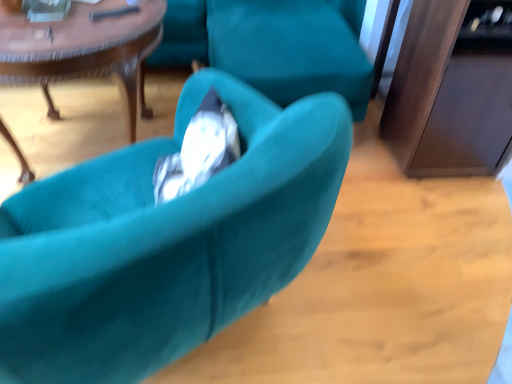
This screenshot has height=384, width=512. What do you see at coordinates (84, 49) in the screenshot? I see `wooden polished coffee table at center` at bounding box center [84, 49].

Identify the location of wooden polished coffee table at center. (84, 49).

What is the approximate width of wooden polished coffee table at center?

wooden polished coffee table at center is 85.18 centimeters in width.

This screenshot has width=512, height=384. Identify the location of teal velvet chair at center. (x=164, y=241).

What do you see at coordinates (164, 241) in the screenshot? The width and height of the screenshot is (512, 384). I see `teal velvet chair at center` at bounding box center [164, 241].

In order to click on wooden polished coffee table at center in this screenshot , I will do `click(84, 49)`.

Can you confirm if teal velvet chair at center is positioned to the left of wooden polished coffee table at center?

No.

Which is behind, teal velvet chair at center or wooden polished coffee table at center?

Positioned behind is wooden polished coffee table at center.

Considering the positions of point (271, 110) and point (51, 53), is point (271, 110) closer or farther from the camera than point (51, 53)?

Point (271, 110).

From the image's perspective, does teal velvet chair at center appear lower than wooden polished coffee table at center?

Indeed, from the image's perspective, teal velvet chair at center is shown beneath wooden polished coffee table at center.

From a real-world perspective, which is physically above, teal velvet chair at center or wooden polished coffee table at center?

From a 3D spatial view, teal velvet chair at center is above.

Considering the relative sizes of teal velvet chair at center and wooden polished coffee table at center in the image provided, is teal velvet chair at center thinner than wooden polished coffee table at center?

Yes.

Who is shorter, teal velvet chair at center or wooden polished coffee table at center?

wooden polished coffee table at center.

Does teal velvet chair at center have a smaller size compared to wooden polished coffee table at center?

No.

Consider the image. Is teal velvet chair at center situated inside wooden polished coffee table at center or outside?

teal velvet chair at center cannot be found inside wooden polished coffee table at center.

Is teal velvet chair at center not near wooden polished coffee table at center?

No.

Is wooden polished coffee table at center at the back of teal velvet chair at center?

teal velvet chair at center does not have its back to wooden polished coffee table at center.

The height and width of the screenshot is (384, 512). What are the coordinates of `chair in front of the wooden polished coffee table at center` in the screenshot? It's located at pos(164,241).

Is wooden polished coffee table at center to the left or to the right of teal velvet chair at center in the image?

Clearly, wooden polished coffee table at center is on the left of teal velvet chair at center in the image.

Considering the positions of objects wooden polished coffee table at center and teal velvet chair at center in the image provided, who is behind, wooden polished coffee table at center or teal velvet chair at center?

wooden polished coffee table at center is more distant.

Does point (131, 65) lie behind point (115, 349)?

Yes, it is.

From the image's perspective, is wooden polished coffee table at center positioned above or below teal velvet chair at center?

wooden polished coffee table at center is situated higher than teal velvet chair at center in the image.

From a real-world perspective, is wooden polished coffee table at center positioned over teal velvet chair at center based on gravity?

No.

Considering the sizes of objects wooden polished coffee table at center and teal velvet chair at center in the image provided, who is wider, wooden polished coffee table at center or teal velvet chair at center?

wooden polished coffee table at center.

Can you confirm if wooden polished coffee table at center is shorter than teal velvet chair at center?

Correct, wooden polished coffee table at center is not as tall as teal velvet chair at center.

Between wooden polished coffee table at center and teal velvet chair at center, which one has larger size?

Bigger between the two is teal velvet chair at center.

Do you think wooden polished coffee table at center is within teal velvet chair at center, or outside of it?

wooden polished coffee table at center cannot be found inside teal velvet chair at center.

Can you see wooden polished coffee table at center touching teal velvet chair at center?

They are not placed beside each other.

Based on the photo, is wooden polished coffee table at center turned away from teal velvet chair at center?

wooden polished coffee table at center is not turned away from teal velvet chair at center.

Locate an element on the screen. chair in front of the wooden polished coffee table at center is located at coordinates (164, 241).

Locate an element on the screen. coffee table lying on the left of teal velvet chair at center is located at coordinates (84, 49).

Identify the location of chair that appears in front of the wooden polished coffee table at center. pos(164,241).